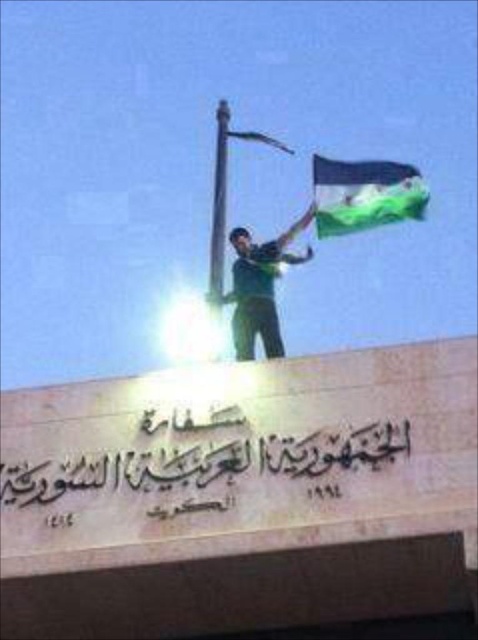
Question: Can you confirm if green fabric flag at upper right is positioned to the left of green matte shirt at center?

Choices:
 (A) yes
 (B) no

Answer: (B)

Question: Which of the following is the farthest from the observer?

Choices:
 (A) green matte shirt at center
 (B) beige stone inscription at center
 (C) green fabric flag at upper right

Answer: (C)

Question: Among these objects, which one is farthest from the camera?

Choices:
 (A) beige stone inscription at center
 (B) green matte shirt at center
 (C) green fabric flag at upper right

Answer: (C)

Question: In this image, where is beige stone inscription at center located relative to green fabric flag at upper right?

Choices:
 (A) above
 (B) below

Answer: (B)

Question: Which point is farther to the camera?

Choices:
 (A) (0, 480)
 (B) (351, 218)

Answer: (B)

Question: Is beige stone inscription at center further to camera compared to green matte shirt at center?

Choices:
 (A) yes
 (B) no

Answer: (B)